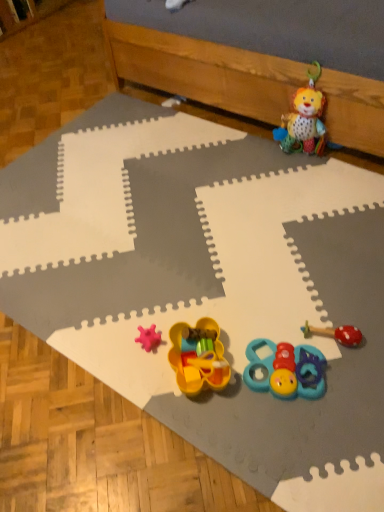
Question: Considering the relative sizes of plush fabric lion at upper right, which appears as the 4th toy when ordered from the bottom, and red rubber teething ring at lower right, which is the 2th toy in back-to-front order, in the image provided, is plush fabric lion at upper right, which appears as the 4th toy when ordered from the bottom, thinner than red rubber teething ring at lower right, which is the 2th toy in back-to-front order,?

Choices:
 (A) no
 (B) yes

Answer: (B)

Question: Considering the relative sizes of plush fabric lion at upper right, which is the 1th toy in back-to-front order, and red rubber teething ring at lower right, which is the 2th toy in back-to-front order, in the image provided, is plush fabric lion at upper right, which is the 1th toy in back-to-front order, bigger than red rubber teething ring at lower right, which is the 2th toy in back-to-front order,?

Choices:
 (A) no
 (B) yes

Answer: (B)

Question: Is plush fabric lion at upper right, the 1th toy viewed from the top, oriented towards red rubber teething ring at lower right, which is the 2th toy in back-to-front order?

Choices:
 (A) yes
 (B) no

Answer: (B)

Question: Would you say plush fabric lion at upper right, which is the 1th toy in back-to-front order, contains red rubber teething ring at lower right, the 2th toy in the top-to-bottom sequence?

Choices:
 (A) no
 (B) yes

Answer: (A)

Question: Is plush fabric lion at upper right, which is the 1th toy in back-to-front order, taller than red rubber teething ring at lower right, which is the 2th toy in back-to-front order?

Choices:
 (A) yes
 (B) no

Answer: (A)

Question: From a real-world perspective, relative to wooden at upper right, is red rubber teething ring at lower right, the 2th toy in the top-to-bottom sequence, vertically above or below?

Choices:
 (A) below
 (B) above

Answer: (A)

Question: Is red rubber teething ring at lower right, positioned as the third toy in bottom-to-top order, bigger or smaller than wooden at upper right?

Choices:
 (A) big
 (B) small

Answer: (B)

Question: Considering their positions, is red rubber teething ring at lower right, which is the 2th toy in back-to-front order, located in front of or behind wooden at upper right?

Choices:
 (A) front
 (B) behind

Answer: (A)

Question: Is red rubber teething ring at lower right, the third toy when ordered from front to back, spatially inside wooden at upper right, or outside of it?

Choices:
 (A) outside
 (B) inside

Answer: (A)

Question: Looking at the image, does plush fabric lion at upper right, the 1th toy viewed from the top, seem bigger or smaller compared to red rubber teething ring at lower right, the third toy when ordered from front to back?

Choices:
 (A) big
 (B) small

Answer: (A)

Question: Relative to red rubber teething ring at lower right, which is the 2th toy in back-to-front order, is plush fabric lion at upper right, the 1th toy viewed from the top, in front or behind?

Choices:
 (A) behind
 (B) front

Answer: (A)

Question: Does point click(284, 119) appear closer or farther from the camera than point click(327, 331)?

Choices:
 (A) farther
 (B) closer

Answer: (A)

Question: From their relative heights in the image, would you say plush fabric lion at upper right, the 4th toy in the front-to-back sequence, is taller or shorter than red rubber teething ring at lower right, the 2th toy in the top-to-bottom sequence?

Choices:
 (A) short
 (B) tall

Answer: (B)

Question: Considering the relative positions of teal rubber teething toy at lower center, acting as the 4th toy starting from the top, and wooden at upper right in the image provided, is teal rubber teething toy at lower center, acting as the 4th toy starting from the top, to the left or to the right of wooden at upper right?

Choices:
 (A) left
 (B) right

Answer: (A)

Question: Considering the positions of teal rubber teething toy at lower center, positioned as the second toy in front-to-back order, and wooden at upper right in the image, is teal rubber teething toy at lower center, positioned as the second toy in front-to-back order, wider or thinner than wooden at upper right?

Choices:
 (A) wide
 (B) thin

Answer: (B)